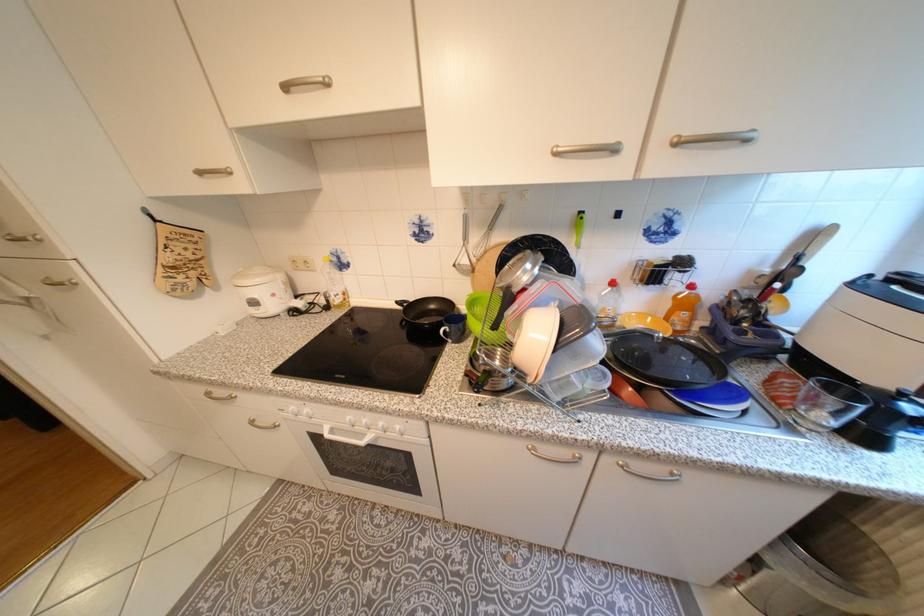
The height and width of the screenshot is (616, 924). What are the coordinates of `pink plastic bowl` in the screenshot? It's located at (535, 341).